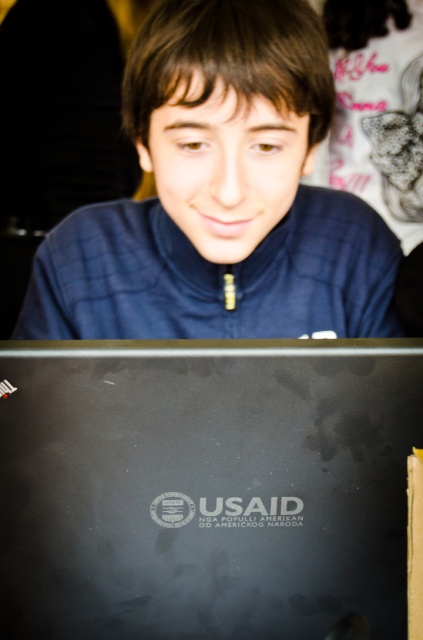
Does black matte laptop at lower center have a lesser height compared to matte blue jacket at center?

Yes.

Does black matte laptop at lower center have a larger size compared to matte blue jacket at center?

No.

This screenshot has width=423, height=640. Find the location of `black matte laptop at lower center`. black matte laptop at lower center is located at coordinates (205, 486).